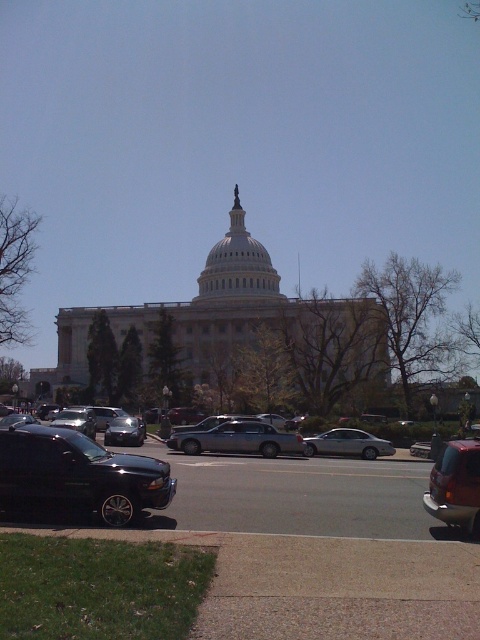
You are a tour guide explaining the vehicles parked near the U.S. Capitol. Which of the two vehicles, the silver metallic station wagon at center or the silver metallic sedan at center, is smaller in size?

The silver metallic station wagon at center is smaller in size compared to the silver metallic sedan at center.

You are a tour guide leading a group near the United States Capitol building. You notice a shiny black sedan at center and a shiny black suv at lower left. Which vehicle would you say is bigger?

The shiny black sedan at center is larger in size compared to the shiny black suv at lower left.